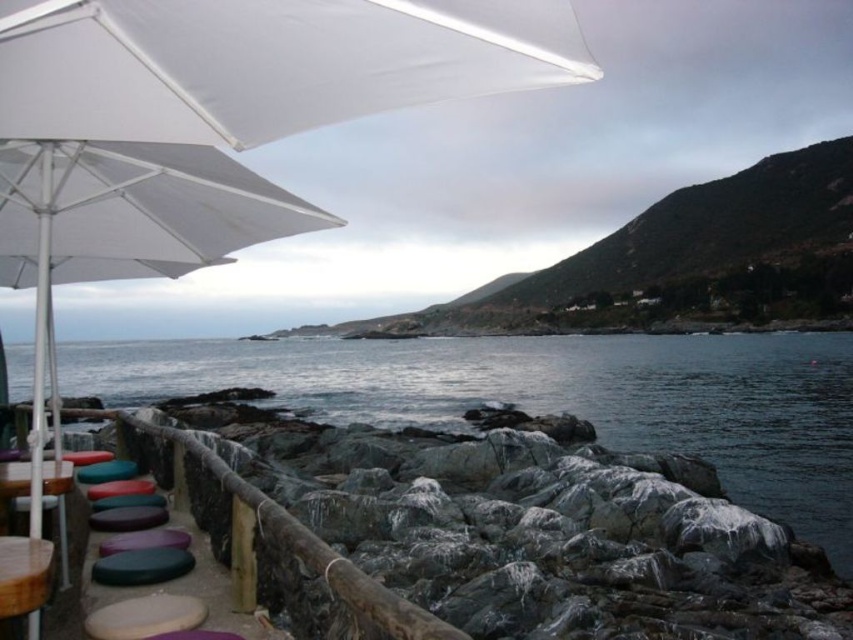
You are a customer at the seaside restaurant and want to sit under the white matte umbrella at upper left. To do so, which side of the wooden table at lower left should you walk around to reach it?

The white matte umbrella at upper left is positioned on the right side of wooden table at lower left, so you should walk around the right side of the wooden table at lower left to reach it.

You are standing at the seaside cafe and want to grab the white matte umbrella at upper left. Considering your height is 1.7 meters, can you reach it without any assistance?

The white matte umbrella at upper left is 4.44 meters from viewer, so you cannot reach it without assistance since it is significantly farther than your height.